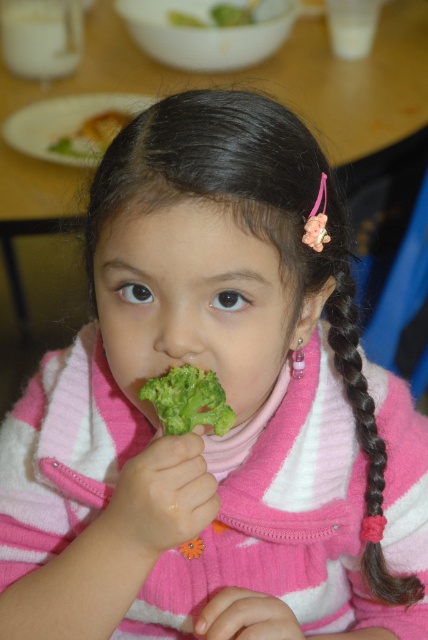
This screenshot has height=640, width=428. Describe the element at coordinates (189, 401) in the screenshot. I see `green matte broccoli at mouth` at that location.

Does green matte broccoli at mouth appear on the right side of green broccoli at center?

Indeed, green matte broccoli at mouth is positioned on the right side of green broccoli at center.

This screenshot has width=428, height=640. What do you see at coordinates (189, 401) in the screenshot? I see `green matte broccoli at mouth` at bounding box center [189, 401].

I want to click on green matte broccoli at mouth, so click(x=189, y=401).